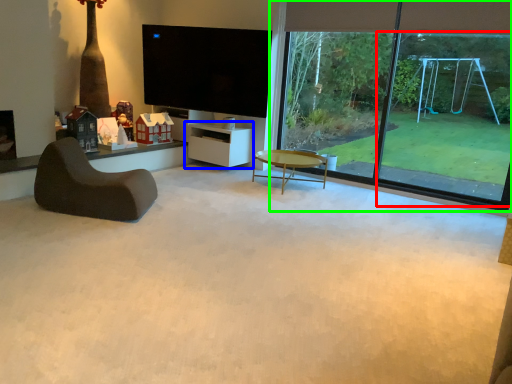
Question: Considering the real-world distances, which object is closest to window frame (highlighted by a red box)? shelf (highlighted by a blue box) or window (highlighted by a green box).

Choices:
 (A) shelf
 (B) window

Answer: (B)